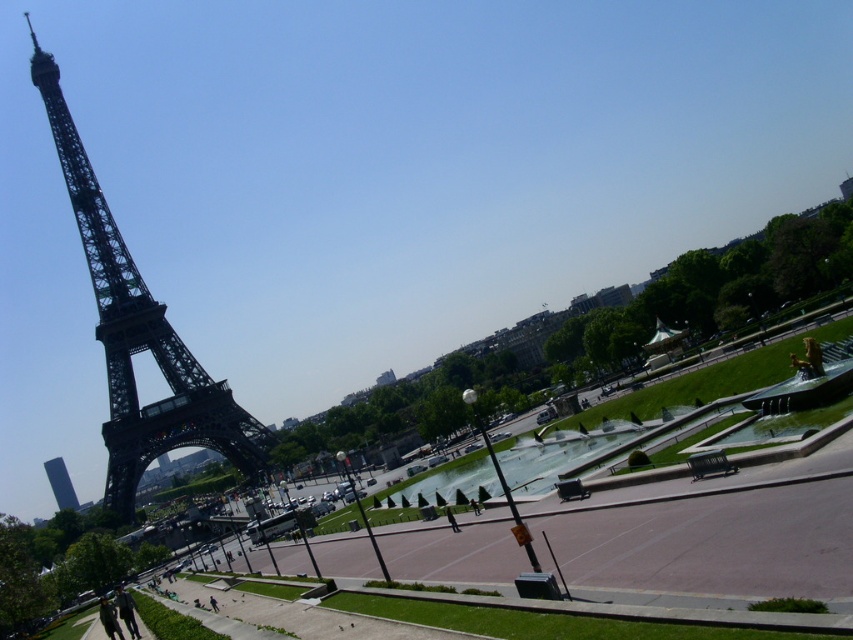
You are standing on the pedestrian walkway and want to take a photo of both the black metal eiffel tower at left and the smooth glass tower at left. Which tower should you position closer to the camera to include both in the frame?

You should position the black metal eiffel tower at left closer to the camera because it is in front of the smooth glass tower at left, so placing it nearer will ensure both are visible in the photo.